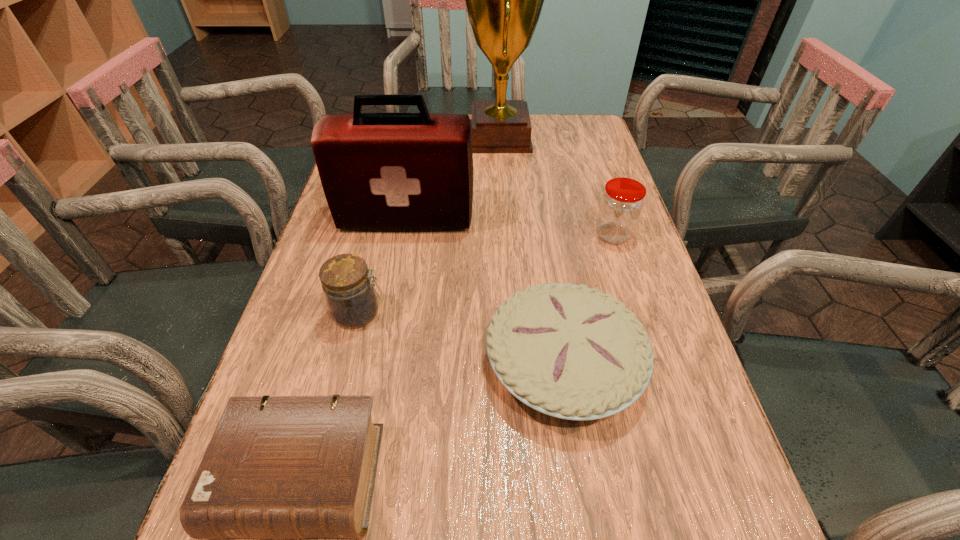
Find the location of a particular element. This screenshot has width=960, height=540. free location located 0.250m on the front of the farther jar is located at coordinates (645, 336).

Locate an element on the screen. Image resolution: width=960 pixels, height=540 pixels. free space located on the lid of the left jar is located at coordinates (569, 313).

In order to click on free region located 0.350m on the left of the pie in this screenshot , I will do `click(294, 363)`.

The image size is (960, 540). I want to click on object that is at the far edge, so click(504, 0).

Where is `the first aid kit that is at the left edge`? Image resolution: width=960 pixels, height=540 pixels. the first aid kit that is at the left edge is located at coordinates (379, 171).

Find the location of `jar at the left edge`. jar at the left edge is located at coordinates (352, 300).

The image size is (960, 540). I want to click on jar that is at the right edge, so click(x=621, y=204).

Identify the location of pie at the right edge. click(x=569, y=351).

Image resolution: width=960 pixels, height=540 pixels. What are the coordinates of `vacant space at the far edge` in the screenshot? It's located at (539, 145).

Identify the location of vacant space at the left edge of the desktop. (292, 341).